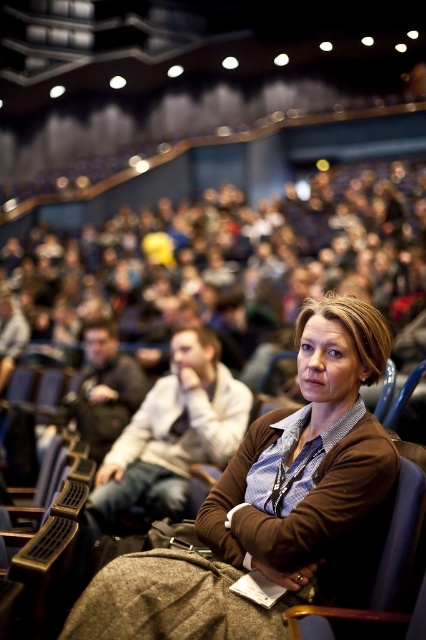
Question: Which point is closer to the camera taking this photo?

Choices:
 (A) click(331, 612)
 (B) click(308, 372)

Answer: (A)

Question: Among these objects, which one is farthest from the camera?

Choices:
 (A) blue fabric chair at center
 (B) brown fabric jacket at center

Answer: (B)

Question: Is the position of brown fabric jacket at center more distant than that of blue fabric chair at center?

Choices:
 (A) no
 (B) yes

Answer: (B)

Question: Where is brown fabric jacket at center located in relation to blue fabric chair at center in the image?

Choices:
 (A) above
 (B) below

Answer: (A)

Question: Does brown fabric jacket at center have a smaller size compared to blue fabric chair at center?

Choices:
 (A) yes
 (B) no

Answer: (B)